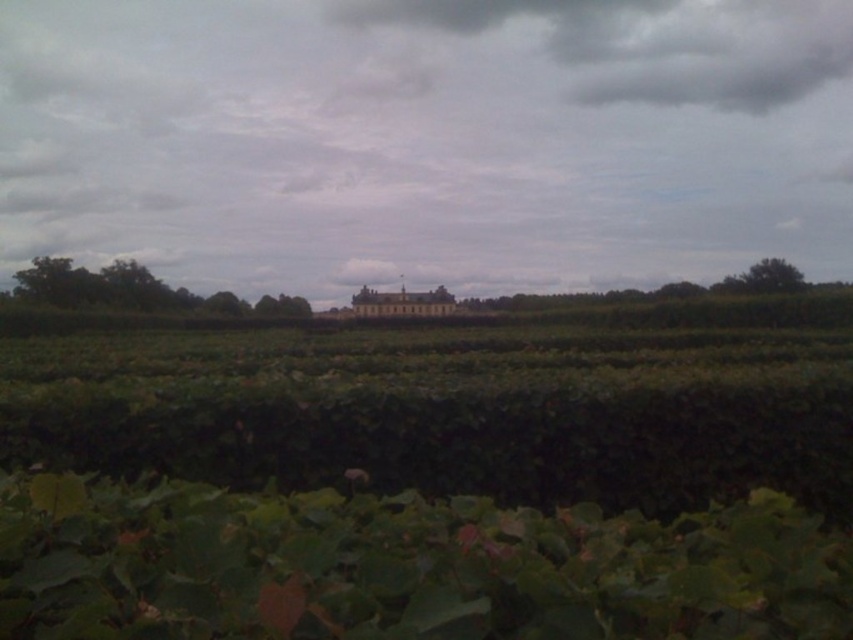
You are a photographer planning to capture the entire scene from the foreground to the background. Given that the gray cloudy sky at center and the green leafy vegetation at center are both in your frame, which one appears taller in the image?

The gray cloudy sky at center appears taller than the green leafy vegetation at center in the image.